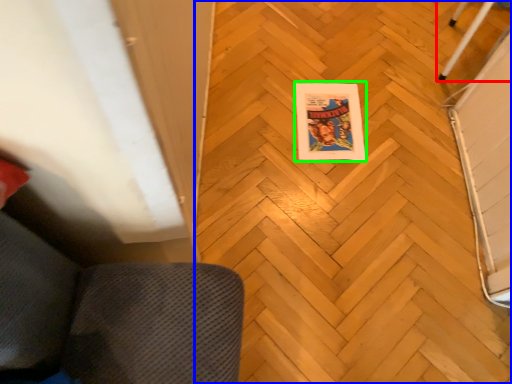
Question: Considering the real-world distances, which object is farthest from furniture (highlighted by a red box)? plywood (highlighted by a blue box) or comic book (highlighted by a green box)?

Choices:
 (A) plywood
 (B) comic book

Answer: (A)